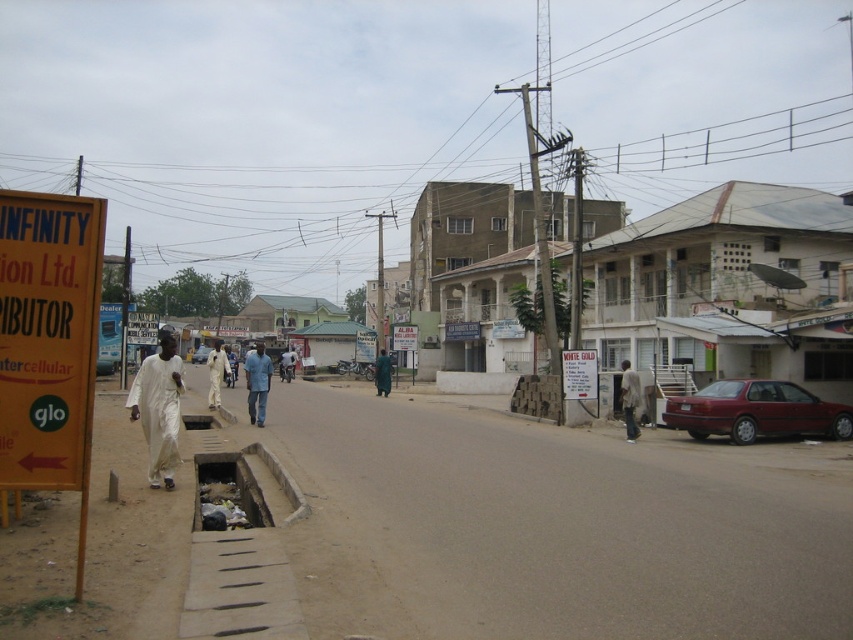
Question: Which object is farther from the camera taking this photo?

Choices:
 (A) white cardboard sign at center
 (B) matte red car at right
 (C) green fabric person at center
 (D) white matte clothing at center

Answer: (C)

Question: Can you confirm if yellow cardboard sign at left is thinner than light brown fabric shirt at center?

Choices:
 (A) yes
 (B) no

Answer: (A)

Question: Estimate the real-world distances between objects in this image. Which object is farther from the matte red car at right?

Choices:
 (A) metallic silver car at center
 (B) blue fabric shirt at center
 (C) yellow cardboard sign at left

Answer: (A)

Question: Can you confirm if matte red car at right is positioned to the right of metallic silver car at center?

Choices:
 (A) yes
 (B) no

Answer: (A)

Question: Which point is farther to the camera?

Choices:
 (A) (161, 412)
 (B) (624, 371)
 (C) (668, 419)
 (D) (221, 355)

Answer: (D)

Question: From the image, what is the correct spatial relationship of white cardboard sign at center in relation to white matte clothing at center?

Choices:
 (A) below
 (B) above

Answer: (B)